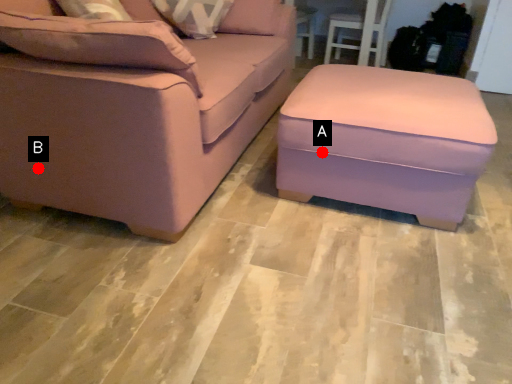
Question: Two points are circled on the image, labeled by A and B beside each circle. Which point is further to the camera?

Choices:
 (A) A is further
 (B) B is further

Answer: (A)